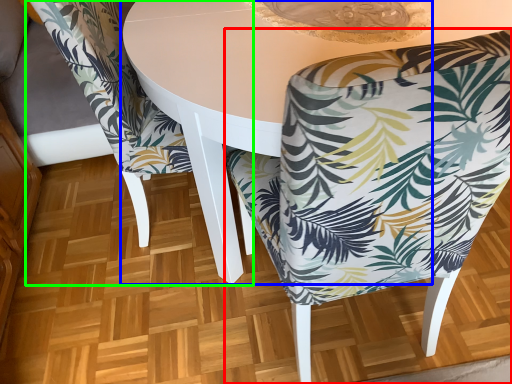
Question: Which object is the closest to the chair (highlighted by a red box)? Choose among these: round table (highlighted by a blue box) or chair (highlighted by a green box).

Choices:
 (A) round table
 (B) chair

Answer: (A)